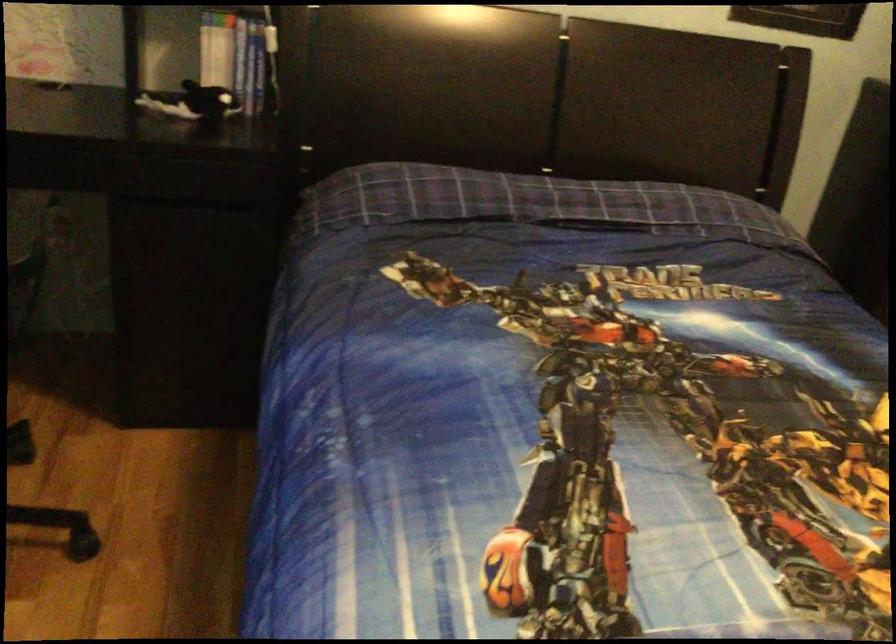
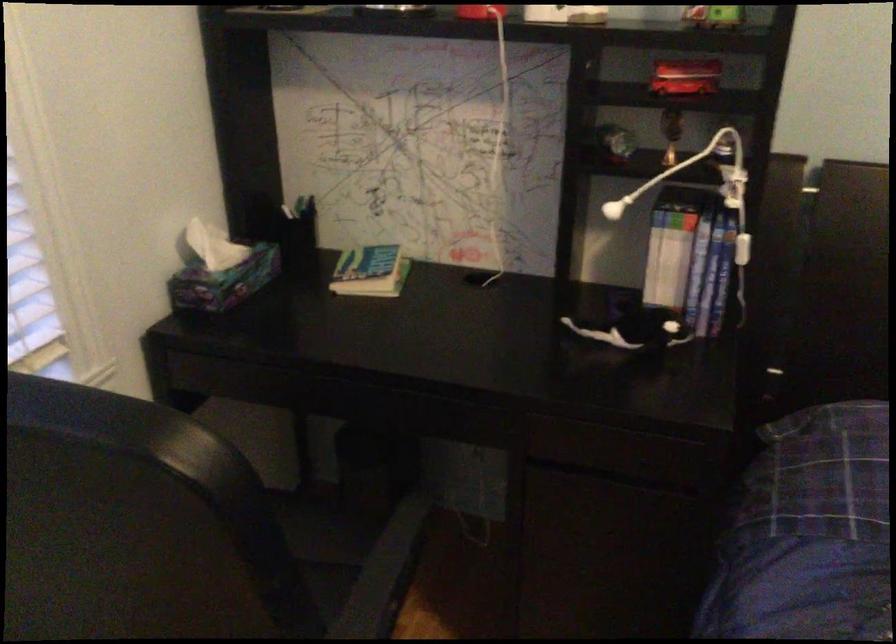
Where in the second image is the point corresponding to [255,77] from the first image?

(707, 288)